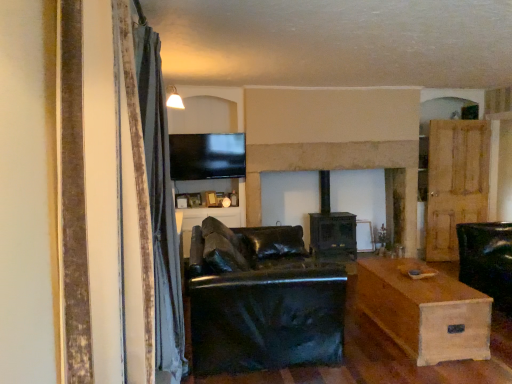
Question: Is stone fireplace at center spatially inside wooden door at right, or outside of it?

Choices:
 (A) outside
 (B) inside

Answer: (A)

Question: From a real-world perspective, is stone fireplace at center positioned above or below wooden door at right?

Choices:
 (A) above
 (B) below

Answer: (A)

Question: Which of these objects is positioned closest to the velvet gray curtain at left?

Choices:
 (A) black leather couch at center
 (B) stone fireplace at center
 (C) light brown wooden table at lower right
 (D) wooden door at right
 (E) flat screen tv at upper center

Answer: (A)

Question: Which object is positioned farthest from the flat screen tv at upper center?

Choices:
 (A) velvet gray curtain at left
 (B) wooden door at right
 (C) black leather couch at center
 (D) light brown wooden table at lower right
 (E) stone fireplace at center

Answer: (A)